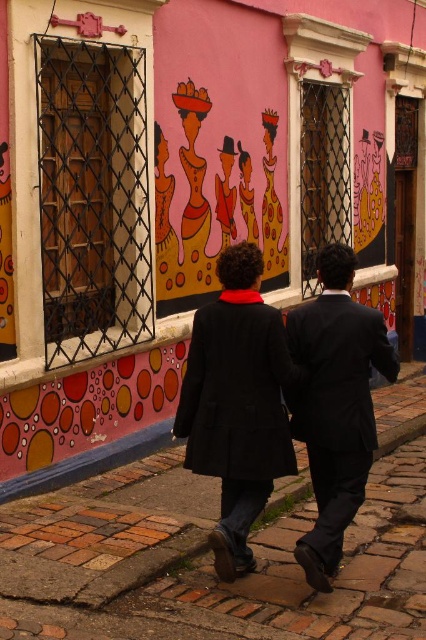
Does matte black coat at center appear over dark blue suit at center?

Yes, matte black coat at center is above dark blue suit at center.

Does point (195, 390) come in front of point (328, 397)?

No, it is not.

Find the location of a particular element. matte black coat at center is located at coordinates (236, 403).

Can you confirm if dark blue suit at center is thinner than matte pink painting of women at center?

Yes, dark blue suit at center is thinner than matte pink painting of women at center.

Is point (317, 480) farther from camera compared to point (158, 275)?

No, it is in front of (158, 275).

Identify the location of dark blue suit at center. The image size is (426, 640). (334, 404).

Is matte black coat at center to the right of matte pink dress at center from the viewer's perspective?

Incorrect, matte black coat at center is not on the right side of matte pink dress at center.

Does point (273, 332) come closer to viewer compared to point (242, 208)?

Yes, it is in front of point (242, 208).

Does point (258, 448) lie in front of point (250, 166)?

Yes, it is.

This screenshot has width=426, height=640. Find the location of `matte black coat at center`. matte black coat at center is located at coordinates (236, 403).